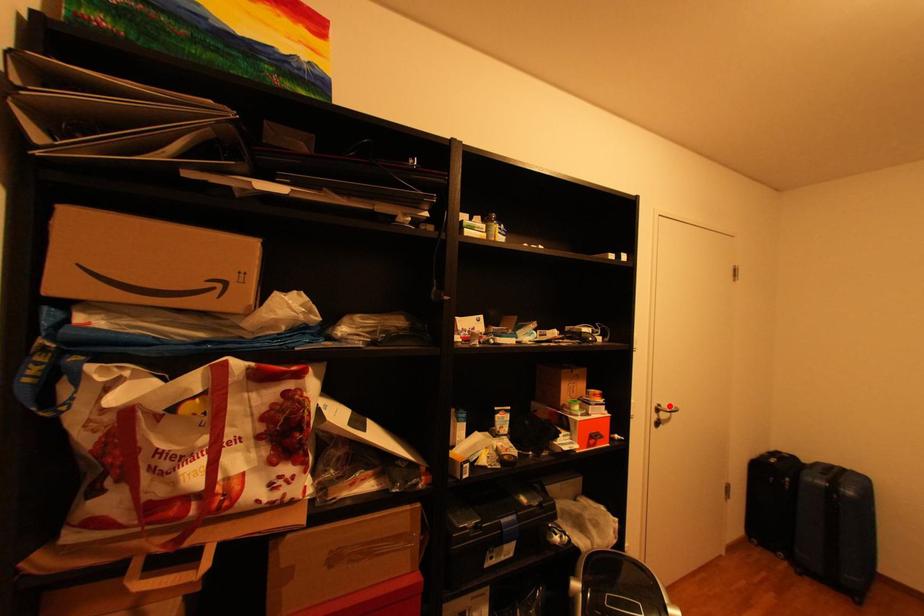
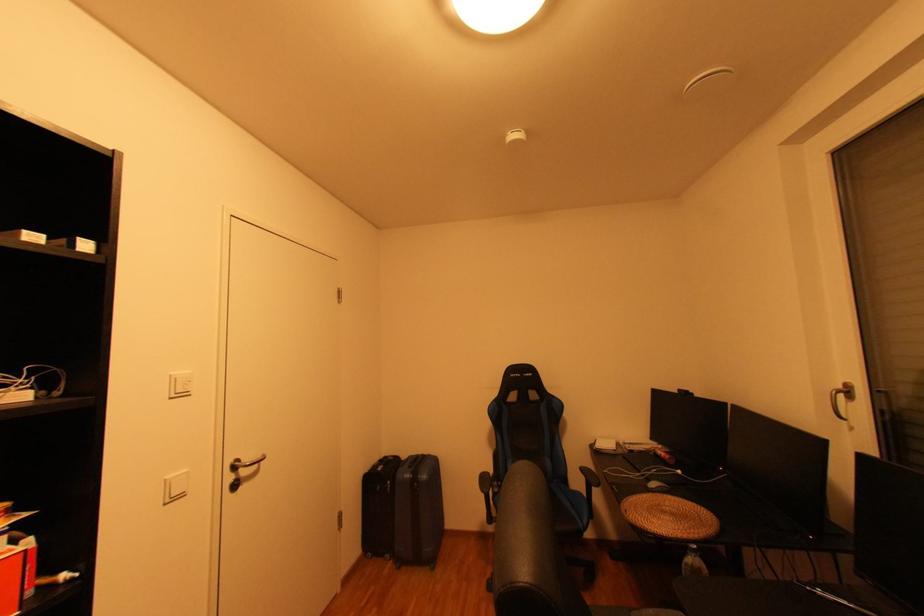
Question: I am providing you with two images of the same scene from different viewpoints. A red point is marked on the first image. Can you still see the location of the red point in image 2?

Choices:
 (A) Yes
 (B) No

Answer: (A)